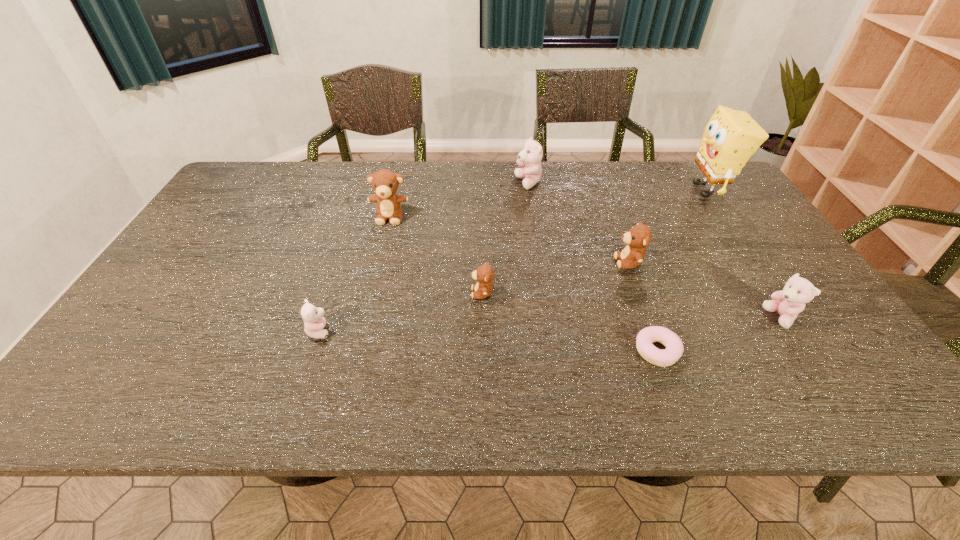
In order to click on yellow sponge in this screenshot , I will do `click(731, 137)`.

Find the location of a particular element. the tallest object is located at coordinates (731, 137).

What are the coordinates of `the fifth object from right to left` in the screenshot? It's located at (531, 155).

Identify the location of the farthest teddy bear. This screenshot has height=540, width=960. (531, 155).

Locate an element on the screen. The width and height of the screenshot is (960, 540). the second farthest teddy bear is located at coordinates (385, 183).

Find the location of a particular element. the leftmost brown teddy bear is located at coordinates (385, 183).

At what (x,y) coordinates should I click in order to perform the action: click on the fifth teddy bear from left to right. Please return your answer as a coordinate pair (x, y). This screenshot has height=540, width=960. Looking at the image, I should click on (639, 236).

Identify the location of the fourth nearest teddy bear. (639, 236).

Where is `the second biggest pink teddy bear`? The height and width of the screenshot is (540, 960). the second biggest pink teddy bear is located at coordinates (788, 303).

What are the coordinates of `the rightmost teddy bear` in the screenshot? It's located at (788, 303).